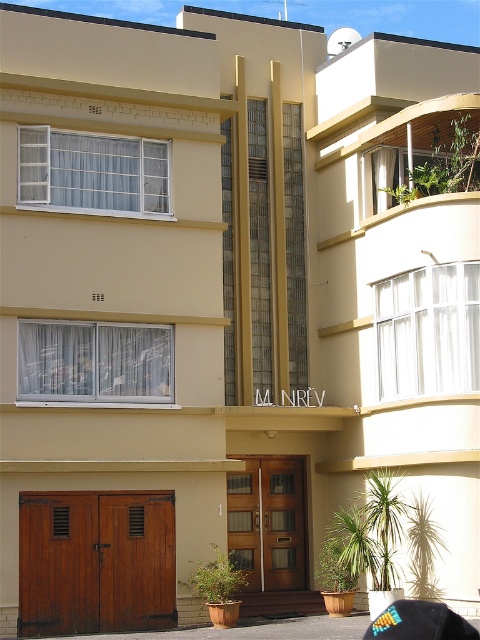
You are a delivery person standing at the entrance of the building. You need to place a small package on the ground between the wooden at lower left and the multicolored fabric baseball cap at lower right. Which object should you place the package closer to if you want it to be closer to the shorter object?

A: The wooden at lower left is not as tall as the multicolored fabric baseball cap at lower right, so the shorter object is the wooden at lower left. Place the package closer to the wooden at lower left.

Based on the photo, you are a delivery person approaching the entrance of the building. You see the brown wooden door at lower left and the multicolored fabric baseball cap at lower right. Which object is closer to you as you face the entrance?

The brown wooden door at lower left is closer to you because the multicolored fabric baseball cap at lower right is behind it.

You are standing at the entrance of the building and want to locate the brown wooden door at lower left. According to the coordinates provided, where exactly is it positioned?

The brown wooden door at lower left is positioned at coordinates point (267, 522).